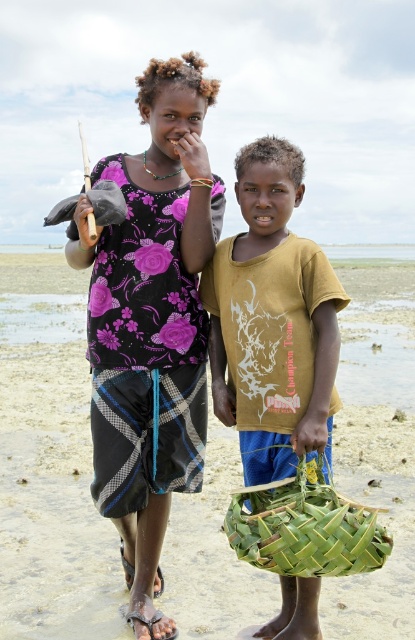
Question: Which object is the farthest from the brown woven sandal at lower center?

Choices:
 (A) yellow matte shirt at center
 (B) green woven basket at lower center
 (C) purple floral shirt at center

Answer: (A)

Question: Does green woven basket at center appear under green woven basket at lower center?

Choices:
 (A) no
 (B) yes

Answer: (A)

Question: Does yellow matte shirt at center appear over brown woven sandal at lower center?

Choices:
 (A) no
 (B) yes

Answer: (B)

Question: Does yellow matte shirt at center appear over brown woven sandal at lower center?

Choices:
 (A) yes
 (B) no

Answer: (A)

Question: Which of these objects is positioned closest to the black woven sandal at lower left?

Choices:
 (A) yellow matte shirt at center
 (B) purple floral shirt at center
 (C) green woven basket at center

Answer: (B)

Question: Among these objects, which one is nearest to the camera?

Choices:
 (A) black woven sandal at lower left
 (B) purple floral shirt at center

Answer: (B)